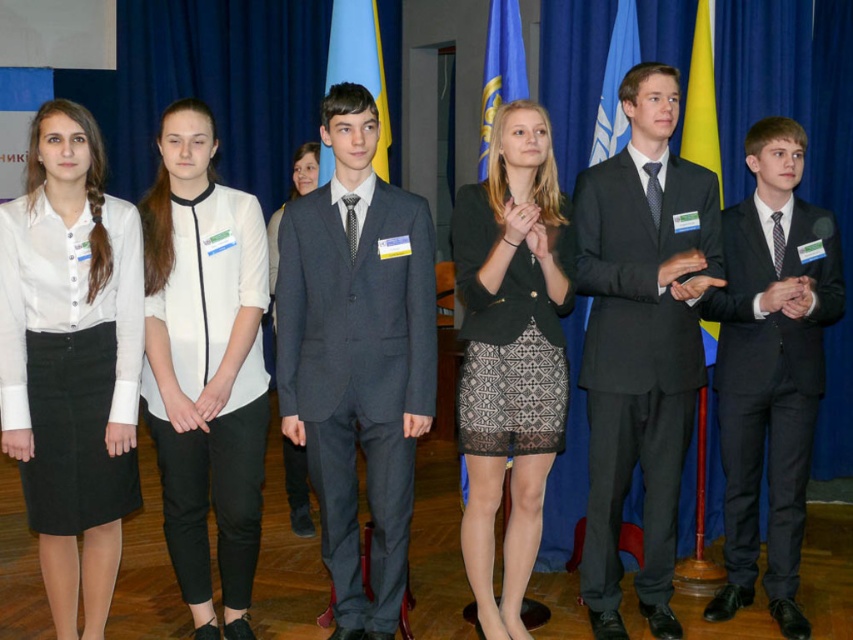
Question: Is dark gray suit at center closer to the viewer compared to matte black dress at center?

Choices:
 (A) yes
 (B) no

Answer: (A)

Question: Does black lace skirt at center have a greater width compared to matte black dress at center?

Choices:
 (A) no
 (B) yes

Answer: (A)

Question: Which point is farther to the camera?

Choices:
 (A) (347, 74)
 (B) (409, 314)
 (C) (177, 145)

Answer: (A)

Question: Among these objects, which one is farthest from the camera?

Choices:
 (A) matte black suit at center
 (B) matte black dress at center
 (C) white cotton blouse at center

Answer: (B)

Question: Can you confirm if white matte blouse at center is smaller than black lace skirt at center?

Choices:
 (A) yes
 (B) no

Answer: (A)

Question: Which object is the closest to the blue fabric flag at center?

Choices:
 (A) matte black dress at center
 (B) black wool suit at right
 (C) white cotton blouse at center
 (D) dark gray suit at center

Answer: (D)